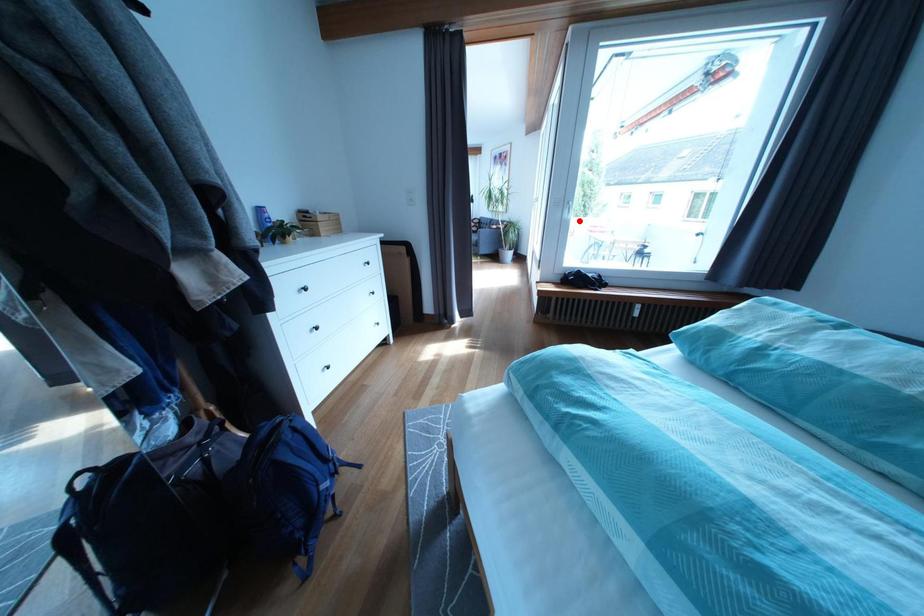
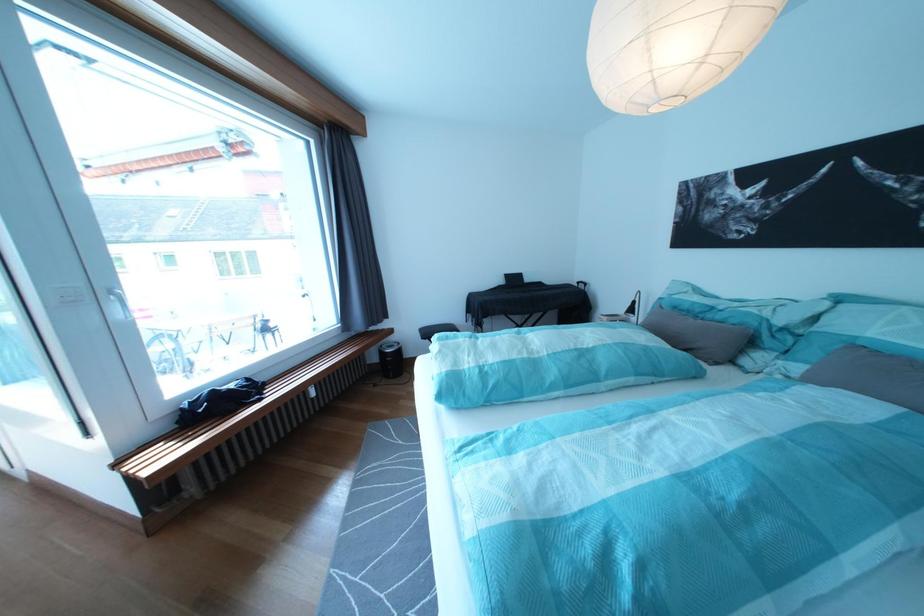
Question: I am providing you with two images of the same scene from different viewpoints. A red point is marked on the first image. At the location where the point appears in image 1, is it still visible in image 2?

Choices:
 (A) Yes
 (B) No

Answer: (A)